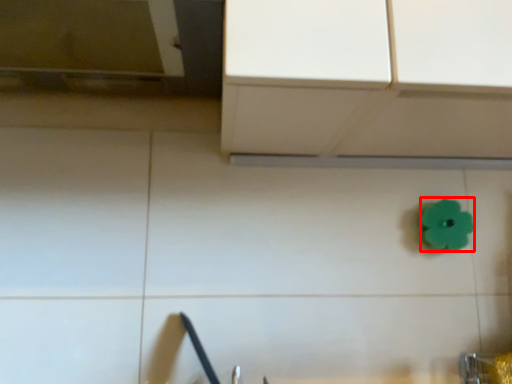
Question: From the image's perspective, where is flower (annotated by the red box) located in relation to faucet in the image?

Choices:
 (A) below
 (B) above

Answer: (B)